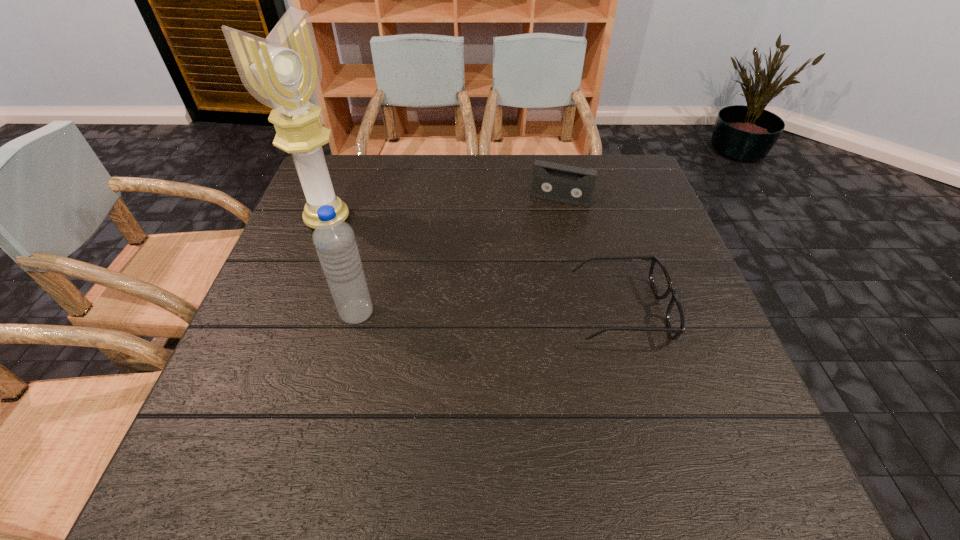
You are a GUI agent. You are given a task and a screenshot of the screen. Output one action in this format:
    pyautogui.click(x=<x>, y=<y>)
    Task: Click on the water bottle
    This screenshot has width=960, height=540.
    Given the screenshot: What is the action you would take?
    pyautogui.click(x=334, y=239)

What are the coordinates of `the second object from left to right` in the screenshot? It's located at (334, 239).

This screenshot has width=960, height=540. Find the location of `the shortest object`. the shortest object is located at coordinates (660, 280).

You are a GUI agent. You are given a task and a screenshot of the screen. Output one action in this format:
    pyautogui.click(x=<x>, y=<y>)
    Task: Click on the videotape
    This screenshot has width=960, height=540.
    Given the screenshot: What is the action you would take?
    pyautogui.click(x=553, y=181)

Find the location of `award`. award is located at coordinates (284, 72).

Find the location of a particular element. The image size is (960, 540). the leftmost object is located at coordinates (284, 72).

You are a GUI agent. You are given a task and a screenshot of the screen. Output one action in this format:
    pyautogui.click(x=<x>, y=<y>)
    Task: Click on the vacant space positioned on the back of the second object from left to right
    This screenshot has height=540, width=960.
    Given the screenshot: What is the action you would take?
    pyautogui.click(x=376, y=234)

Where is `free space located on the front-facing side of the second shortest object`? Image resolution: width=960 pixels, height=540 pixels. free space located on the front-facing side of the second shortest object is located at coordinates (530, 268).

This screenshot has width=960, height=540. I want to click on vacant space located on the front-facing side of the second shortest object, so click(524, 283).

At what (x,y) coordinates should I click in order to perform the action: click on vacant area located on the front-facing side of the second shortest object. Please return your answer as a coordinate pair (x, y). The image size is (960, 540). Looking at the image, I should click on (515, 309).